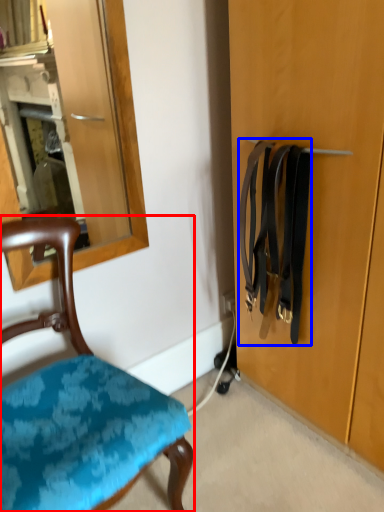
Question: Which of the following is the closest to the observer, chair (highlighted by a red box) or suspenders (highlighted by a blue box)?

Choices:
 (A) chair
 (B) suspenders

Answer: (A)